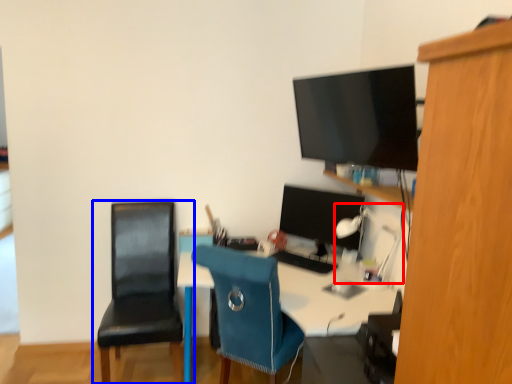
Question: Which point is further to the camera, lamp (highlighted by a red box) or chair (highlighted by a blue box)?

Choices:
 (A) lamp
 (B) chair

Answer: (A)